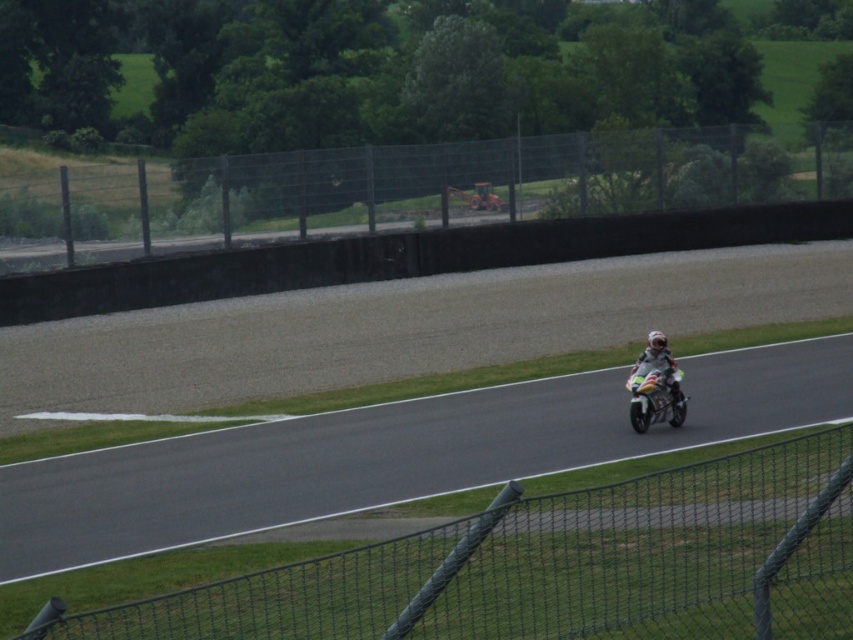
Question: Which object is positioned farthest from the shiny silver motorcycle at center?

Choices:
 (A) black mesh fence at lower right
 (B) metallic wire mesh fence at upper center

Answer: (B)

Question: Is black mesh fence at lower right to the right of shiny silver motorcycle at center from the viewer's perspective?

Choices:
 (A) yes
 (B) no

Answer: (B)

Question: Among these points, which one is farthest from the camera?

Choices:
 (A) (59, 230)
 (B) (529, 627)

Answer: (A)

Question: Which object is closer to the camera taking this photo?

Choices:
 (A) metallic wire mesh fence at upper center
 (B) shiny silver motorcycle at center

Answer: (B)

Question: Is the position of black mesh fence at lower right more distant than that of shiny silver motorcycle at center?

Choices:
 (A) no
 (B) yes

Answer: (A)

Question: Is black mesh fence at lower right below shiny silver motorcycle at center?

Choices:
 (A) yes
 (B) no

Answer: (B)